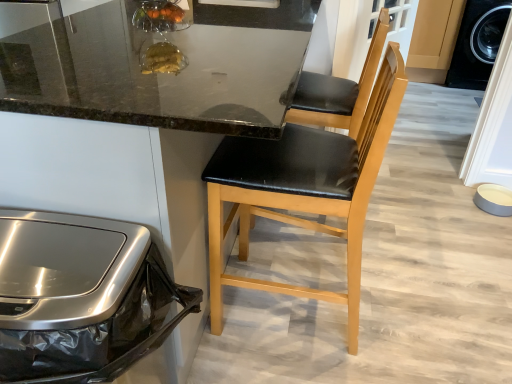
Question: Does black leather chair at center have a lesser width compared to black leather chair at center?

Choices:
 (A) no
 (B) yes

Answer: (A)

Question: Considering the relative sizes of black leather chair at center and black leather chair at center in the image provided, is black leather chair at center bigger than black leather chair at center?

Choices:
 (A) yes
 (B) no

Answer: (A)

Question: Is black leather chair at center smaller than black leather chair at center?

Choices:
 (A) yes
 (B) no

Answer: (B)

Question: From the image's perspective, would you say black leather chair at center is shown under black leather chair at center?

Choices:
 (A) yes
 (B) no

Answer: (B)

Question: From a real-world perspective, does black leather chair at center stand above black leather chair at center?

Choices:
 (A) no
 (B) yes

Answer: (B)

Question: Considering the relative positions of black leather chair at center and black leather chair at center in the image provided, is black leather chair at center behind black leather chair at center?

Choices:
 (A) yes
 (B) no

Answer: (B)

Question: Is matte gray bowl at lower right at the left side of stainless steel trash can at left?

Choices:
 (A) no
 (B) yes

Answer: (A)

Question: From the image's perspective, is matte gray bowl at lower right beneath stainless steel trash can at left?

Choices:
 (A) yes
 (B) no

Answer: (B)

Question: Is matte gray bowl at lower right bigger than stainless steel trash can at left?

Choices:
 (A) no
 (B) yes

Answer: (A)

Question: Does matte gray bowl at lower right have a smaller size compared to stainless steel trash can at left?

Choices:
 (A) no
 (B) yes

Answer: (B)

Question: Is matte gray bowl at lower right outside of stainless steel trash can at left?

Choices:
 (A) yes
 (B) no

Answer: (A)

Question: From a real-world perspective, is matte gray bowl at lower right positioned over stainless steel trash can at left based on gravity?

Choices:
 (A) yes
 (B) no

Answer: (B)

Question: Can you confirm if stainless steel trash can at left is bigger than black leather chair at center?

Choices:
 (A) yes
 (B) no

Answer: (B)